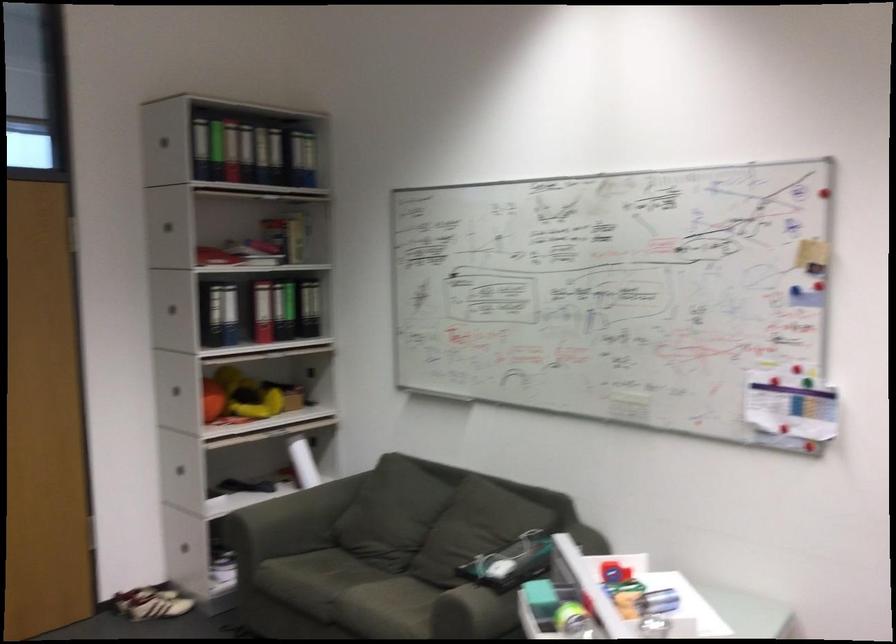
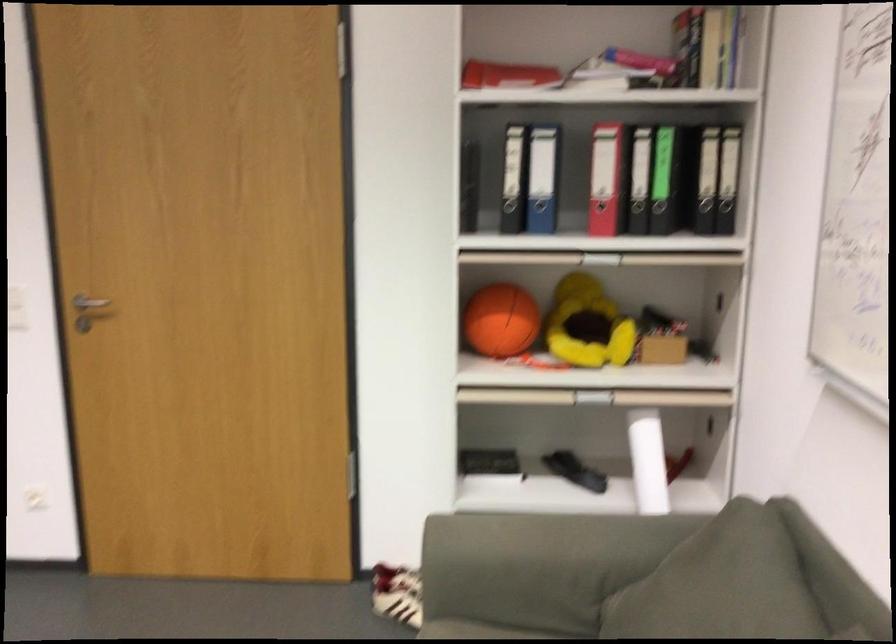
Locate, in the second image, the point that corresponds to pixel 194 263 in the first image.

(506, 75)